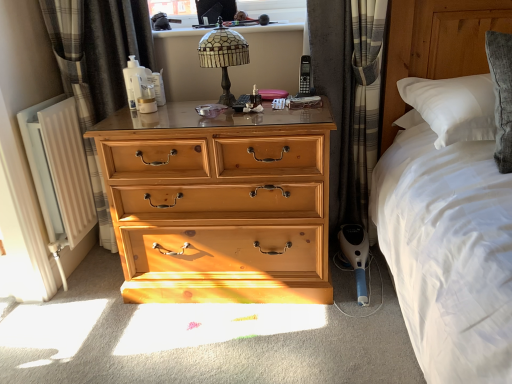
Question: Can you confirm if plaid fabric curtain at right, the first curtain viewed from the right, is positioned to the right of stained glass lampshade at upper center?

Choices:
 (A) yes
 (B) no

Answer: (A)

Question: Is plaid fabric curtain at right, which is the second curtain from left to right, turned away from stained glass lampshade at upper center?

Choices:
 (A) yes
 (B) no

Answer: (B)

Question: Would you say plaid fabric curtain at right, the first curtain viewed from the right, is outside stained glass lampshade at upper center?

Choices:
 (A) yes
 (B) no

Answer: (A)

Question: From the image's perspective, is plaid fabric curtain at right, which is the second curtain from left to right, beneath stained glass lampshade at upper center?

Choices:
 (A) no
 (B) yes

Answer: (B)

Question: Could you tell me if plaid fabric curtain at right, which is the second curtain from left to right, is facing stained glass lampshade at upper center?

Choices:
 (A) no
 (B) yes

Answer: (A)

Question: From a real-world perspective, is white painted metal radiator at left physically located above or below plaid fabric curtain at right, the first curtain viewed from the right?

Choices:
 (A) above
 (B) below

Answer: (B)

Question: From the image's perspective, is white painted metal radiator at left located above or below plaid fabric curtain at right, the first curtain viewed from the right?

Choices:
 (A) above
 (B) below

Answer: (B)

Question: Is white painted metal radiator at left wider or thinner than plaid fabric curtain at right, which is the second curtain from left to right?

Choices:
 (A) thin
 (B) wide

Answer: (A)

Question: Based on their sizes in the image, would you say white painted metal radiator at left is bigger or smaller than plaid fabric curtain at right, which is the second curtain from left to right?

Choices:
 (A) small
 (B) big

Answer: (A)

Question: Is white painted metal radiator at left inside the boundaries of stained glass lampshade at upper center, or outside?

Choices:
 (A) outside
 (B) inside

Answer: (A)

Question: Looking at their shapes, would you say white painted metal radiator at left is wider or thinner than stained glass lampshade at upper center?

Choices:
 (A) thin
 (B) wide

Answer: (A)

Question: Relative to stained glass lampshade at upper center, is white painted metal radiator at left in front or behind?

Choices:
 (A) behind
 (B) front

Answer: (A)

Question: From the image's perspective, is white painted metal radiator at left positioned above or below stained glass lampshade at upper center?

Choices:
 (A) below
 (B) above

Answer: (A)

Question: In terms of size, does stained glass lampshade at upper center appear bigger or smaller than wooden chest of drawers at center?

Choices:
 (A) small
 (B) big

Answer: (A)

Question: From a real-world perspective, is stained glass lampshade at upper center physically located above or below wooden chest of drawers at center?

Choices:
 (A) above
 (B) below

Answer: (A)